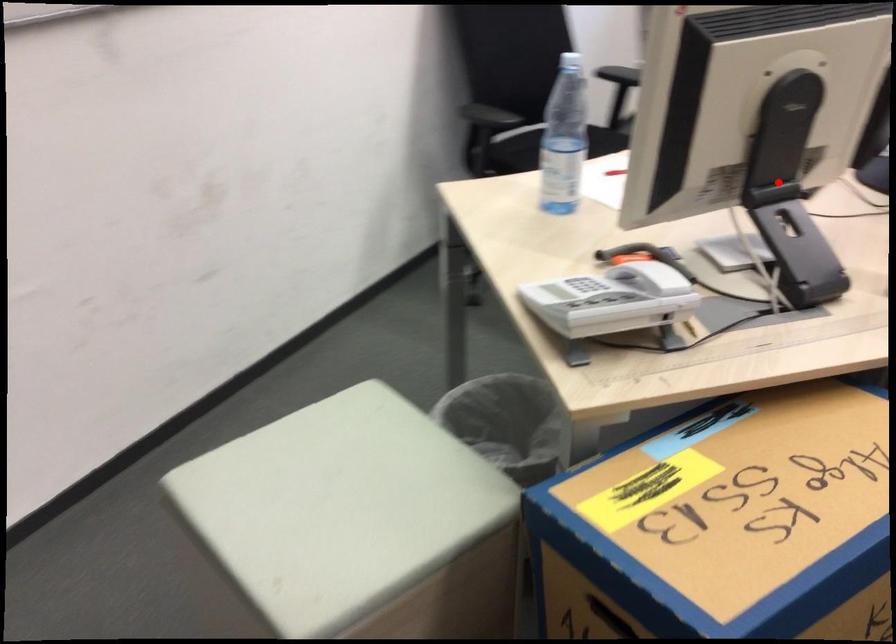
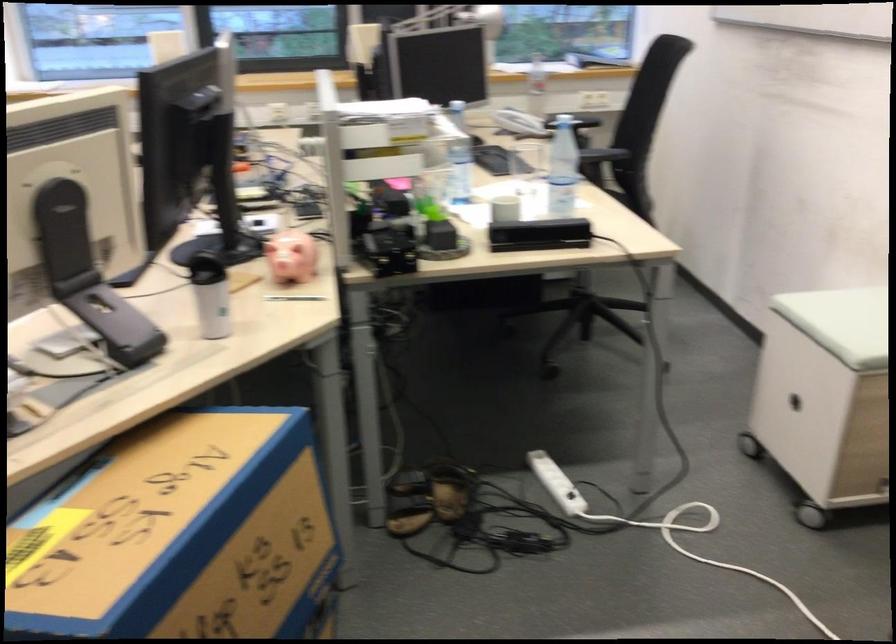
Where in the second image is the point corresponding to the highlighted location from the first image?

(88, 275)